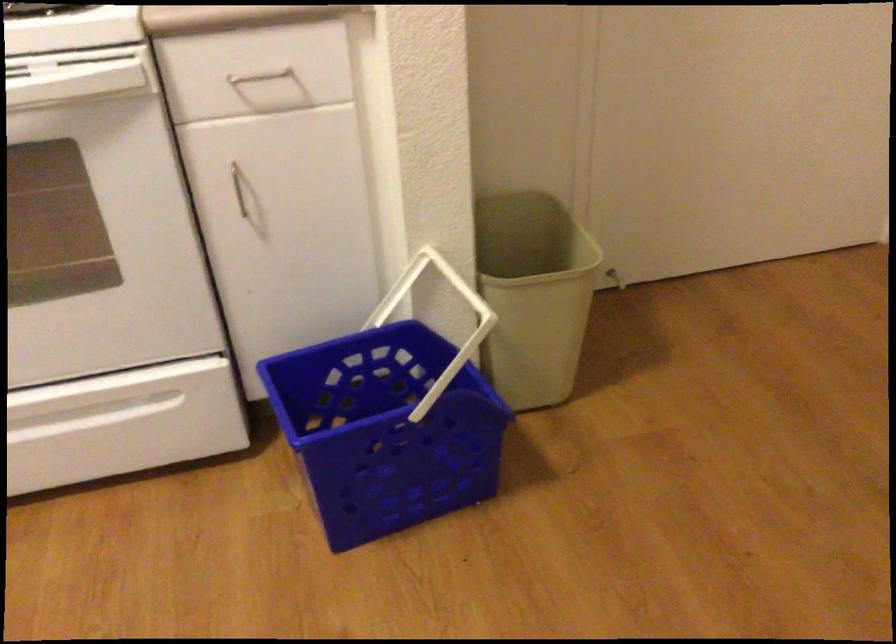
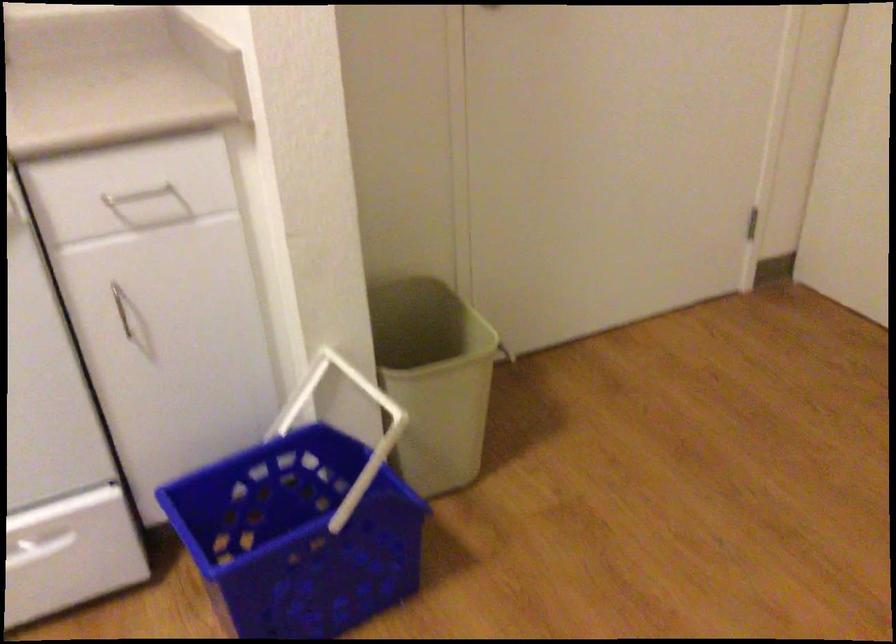
Question: The camera is either moving clockwise (left) or counter-clockwise (right) around the object. The first image is from the beginning of the video and the second image is from the end. Is the camera moving left or right when shooting the video?

Choices:
 (A) Left
 (B) Right

Answer: (A)